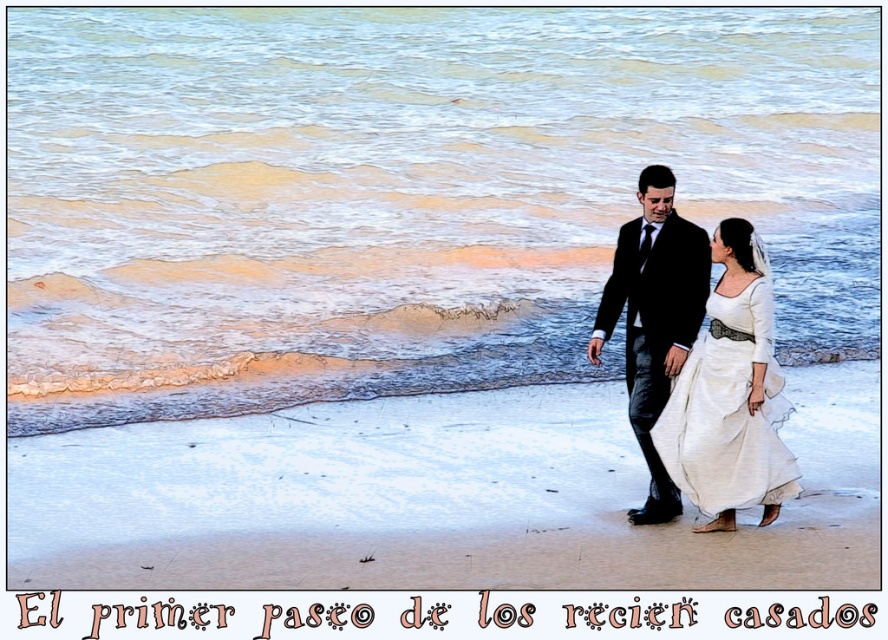
Question: Does white satin dress at lower right have a lesser width compared to black satin suit at center?

Choices:
 (A) no
 (B) yes

Answer: (A)

Question: Is white satin dress at lower right to the right of black satin suit at center from the viewer's perspective?

Choices:
 (A) yes
 (B) no

Answer: (A)

Question: Does white satin dress at lower right have a greater width compared to black satin suit at center?

Choices:
 (A) yes
 (B) no

Answer: (A)

Question: Among these objects, which one is farthest from the camera?

Choices:
 (A) black satin suit at center
 (B) white satin dress at lower right

Answer: (A)